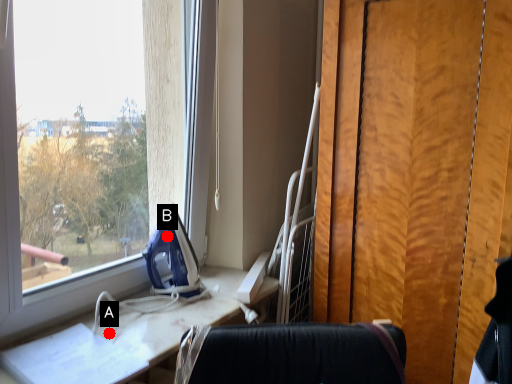
Question: Two points are circled on the image, labeled by A and B beside each circle. Which point is further to the camera?

Choices:
 (A) A is further
 (B) B is further

Answer: (B)